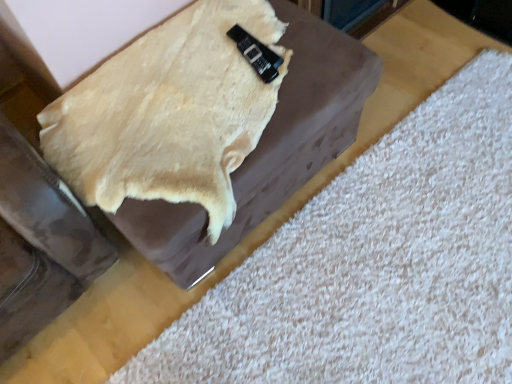
What do you see at coordinates (169, 113) in the screenshot?
I see `fuzzy beige blanket at upper center` at bounding box center [169, 113].

The height and width of the screenshot is (384, 512). Find the location of `fuzzy beige blanket at upper center`. fuzzy beige blanket at upper center is located at coordinates (169, 113).

Where is `fuzzy beige blanket at upper center`? fuzzy beige blanket at upper center is located at coordinates click(x=169, y=113).